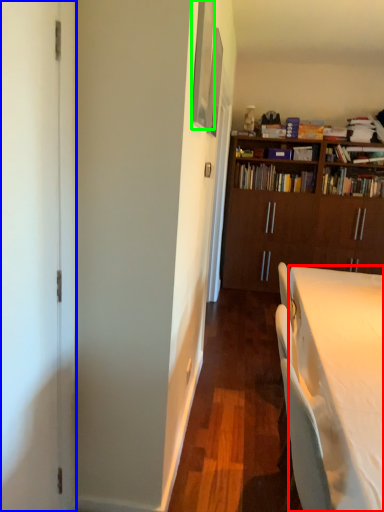
Question: Which is farther away from desk (highlighted by a red box)? screen door (highlighted by a blue box) or picture frame (highlighted by a green box)?

Choices:
 (A) screen door
 (B) picture frame

Answer: (B)